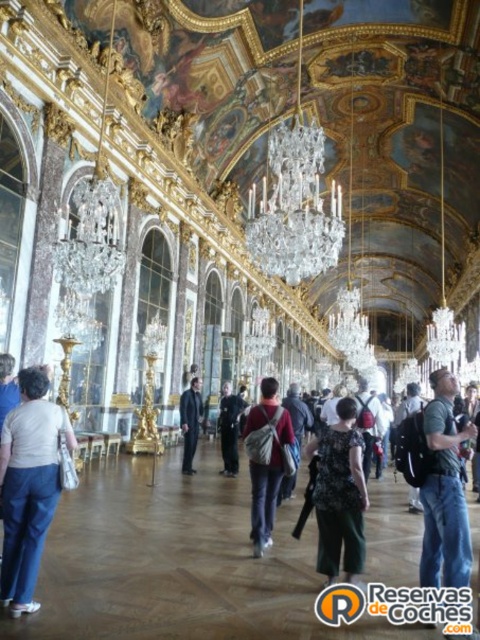
Who is more distant from viewer, (433, 470) or (263, 538)?

Point (263, 538)

You are a GUI agent. You are given a task and a screenshot of the screen. Output one action in this format:
    pyautogui.click(x=<x>, y=<y>)
    Task: Click on the green fabric backpack at center
    
    Given the screenshot: What is the action you would take?
    pyautogui.click(x=444, y=492)

Does black textured dress at center have a greater height compared to matte red backpack at center?

Yes, black textured dress at center is taller than matte red backpack at center.

Is black textured dress at center positioned behind matte red backpack at center?

That is False.

Which is behind, point (336, 529) or point (280, 420)?

The point (280, 420) is behind.

Find the location of a particular element. The width and height of the screenshot is (480, 640). black textured dress at center is located at coordinates (339, 493).

Between green fabric backpack at center and black textured dress at center, which one has less height?

black textured dress at center

What do you see at coordinates (444, 492) in the screenshot?
I see `green fabric backpack at center` at bounding box center [444, 492].

Who is more forward, (429,529) or (321,534)?

Positioned in front is point (429,529).

Locate an element on the screen. green fabric backpack at center is located at coordinates (444, 492).